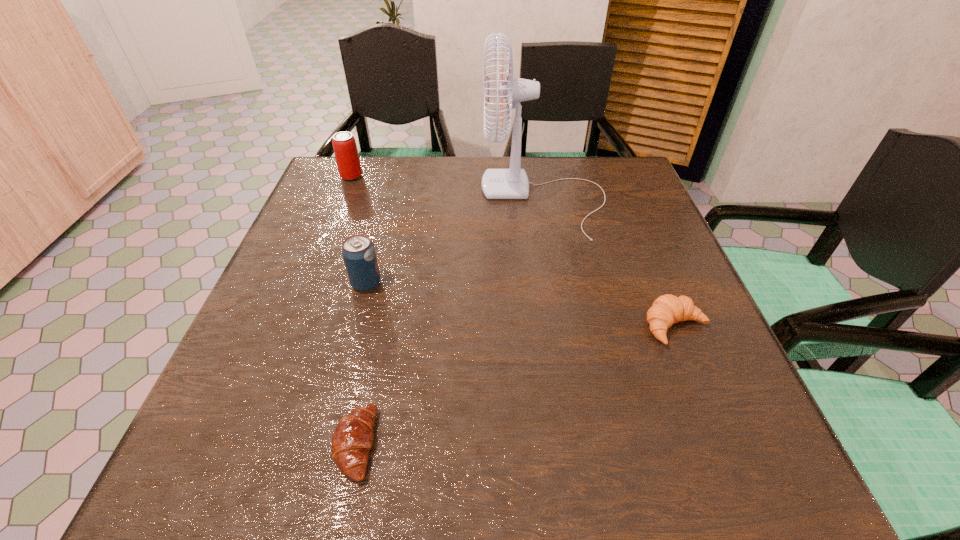
Where is `vacant region located 0.120m on the front of the leftmost object`? The image size is (960, 540). vacant region located 0.120m on the front of the leftmost object is located at coordinates (339, 208).

This screenshot has width=960, height=540. I want to click on vacant position located 0.290m on the right of the third farthest object, so click(521, 284).

You are a GUI agent. You are given a task and a screenshot of the screen. Output one action in this format:
    pyautogui.click(x=<x>, y=<y>)
    Task: Click on the vacant space located 0.080m on the left of the fourth farthest object
    The height and width of the screenshot is (540, 960).
    Given the screenshot: What is the action you would take?
    [x=602, y=327]

You are a GUI agent. You are given a task and a screenshot of the screen. Output one action in this format:
    pyautogui.click(x=<x>, y=<y>)
    Task: Click on the vacant region located on the back of the nearer crescent roll
    This screenshot has width=960, height=540.
    Given the screenshot: What is the action you would take?
    (395, 256)

Identify the location of fan that is at the far edge. This screenshot has height=540, width=960. (512, 183).

This screenshot has height=540, width=960. Find the location of `beer can at the far edge`. beer can at the far edge is located at coordinates (347, 158).

You are a GUI agent. You are given a task and a screenshot of the screen. Output one action in this format:
    pyautogui.click(x=<x>, y=<y>)
    Task: Click on the object located at the near edge
    Image resolution: width=960 pixels, height=540 pixels.
    Given the screenshot: What is the action you would take?
    pyautogui.click(x=353, y=437)

Where is `object positioned at the left edge`? The image size is (960, 540). object positioned at the left edge is located at coordinates (347, 158).

The width and height of the screenshot is (960, 540). What are the coordinates of `fan that is positioned at the right edge` in the screenshot? It's located at (512, 183).

At what (x,y) coordinates should I click in order to perform the action: click on crescent roll present at the right edge. Please return your answer as a coordinate pair (x, y). The width and height of the screenshot is (960, 540). Looking at the image, I should click on (666, 310).